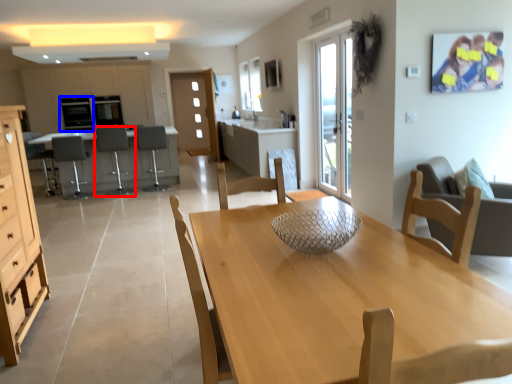
Question: Which point is further to the camera, chair (highlighted by a red box) or appliance (highlighted by a blue box)?

Choices:
 (A) chair
 (B) appliance

Answer: (B)